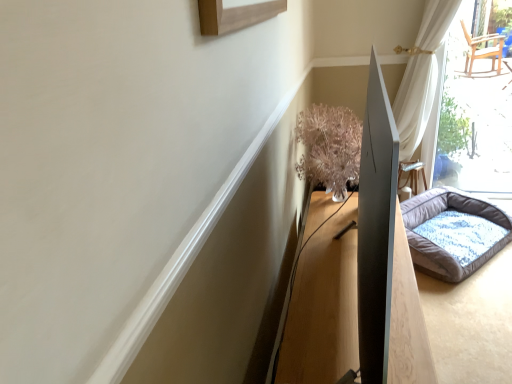
Question: From a real-world perspective, is translucent glass vase at upper right physically located above or below wooden table at center?

Choices:
 (A) below
 (B) above

Answer: (B)

Question: In the image, is translucent glass vase at upper right positioned in front of or behind wooden table at center?

Choices:
 (A) front
 (B) behind

Answer: (B)

Question: Estimate the real-world distances between objects in this image. Which object is farther from the fluffy gray dog bed at right?

Choices:
 (A) wooden table at center
 (B) translucent glass vase at upper right

Answer: (A)

Question: Based on their relative distances, which object is nearer to the fluffy gray dog bed at right?

Choices:
 (A) wooden table at center
 (B) translucent glass vase at upper right

Answer: (B)